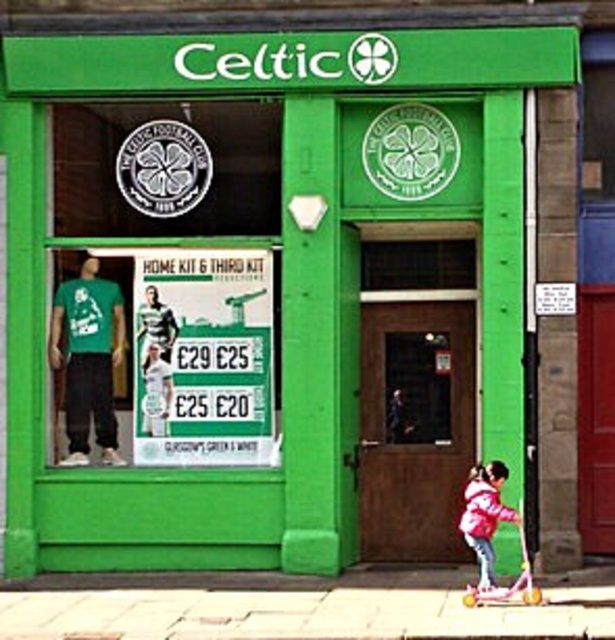
Is paved stone pavement at lower center below pink fabric jacket at lower right?

Yes.

The width and height of the screenshot is (615, 640). I want to click on paved stone pavement at lower center, so click(298, 612).

Between point (260, 612) and point (502, 508), which one is positioned in front?

Point (260, 612)

In order to click on paved stone pavement at lower center in this screenshot , I will do `click(298, 612)`.